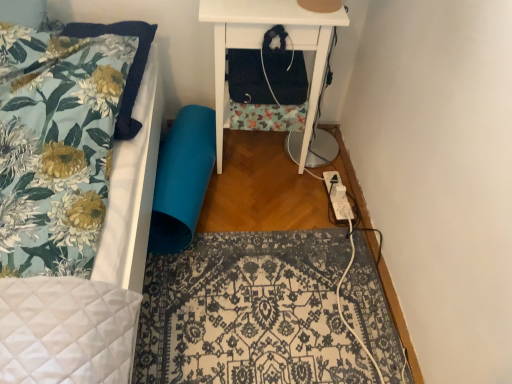
The height and width of the screenshot is (384, 512). Find the location of `vacant space to the right of teal fabric swivel chair at lower left`. vacant space to the right of teal fabric swivel chair at lower left is located at coordinates (262, 192).